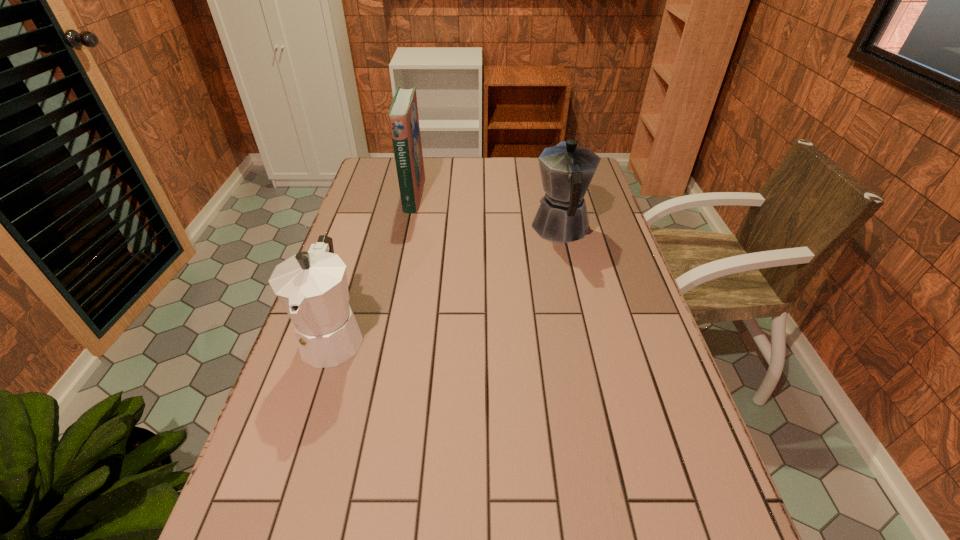
Identify the location of vacant area between the hardback book and the leftmost object. This screenshot has height=540, width=960. (373, 265).

This screenshot has height=540, width=960. I want to click on empty location between the leftmost object and the right coffeepot, so click(447, 282).

Identify the location of free space between the nearer coffeepot and the rightmost object. (447, 282).

Identify the location of free spot between the hardback book and the nearest object. (373, 265).

The width and height of the screenshot is (960, 540). In order to click on vacant point located between the leftmost object and the rightmost object in this screenshot , I will do `click(447, 282)`.

This screenshot has width=960, height=540. Identify the location of free point between the second object from right to left and the right coffeepot. (487, 211).

You are a GUI agent. You are given a task and a screenshot of the screen. Output one action in this format:
    pyautogui.click(x=<x>, y=<y>)
    Task: Click on the object that stands as the closest to the left coffeepot
    
    Given the screenshot: What is the action you would take?
    pyautogui.click(x=403, y=115)

I want to click on object identified as the closest to the nearer coffeepot, so click(x=403, y=115).

Locate an element on the screen. This screenshot has width=960, height=540. free region that satisfies the following two spatial constraints: 1. on the cover of the second object from right to left; 2. at the spout of the leftmost object is located at coordinates [x=384, y=335].

Image resolution: width=960 pixels, height=540 pixels. Identify the location of free space in the image that satisfies the following two spatial constraints: 1. on the cover of the second object from right to left; 2. at the spout of the right coffeepot. (406, 228).